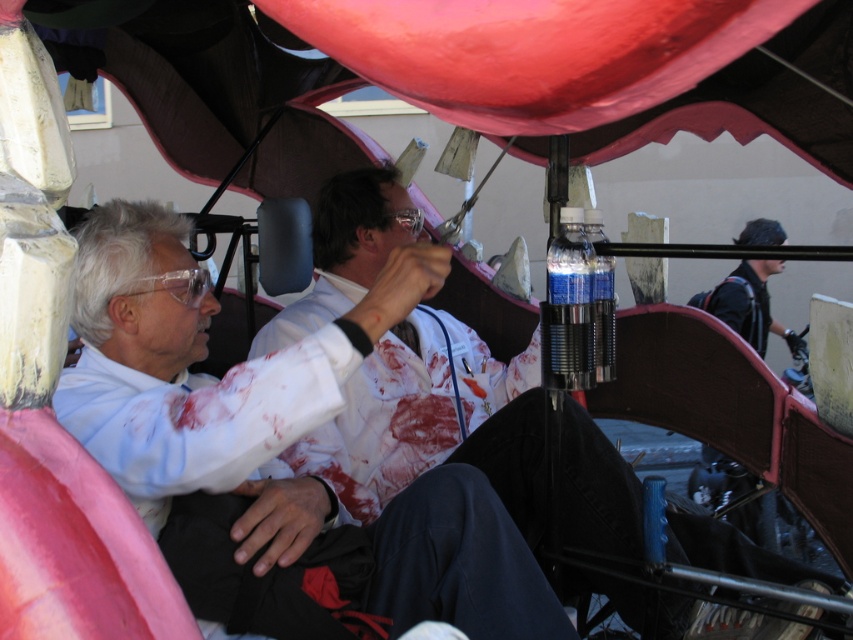
Between point (474, 401) and point (772, 529), which one is positioned in front?

Point (474, 401)

In the scene shown: Can you confirm if blood-stained lab coat at center is wider than dark blue fabric jacket at right?

Correct, the width of blood-stained lab coat at center exceeds that of dark blue fabric jacket at right.

Locate an element on the screen. The image size is (853, 640). blood-stained lab coat at center is located at coordinates (432, 420).

You are a GUI agent. You are given a task and a screenshot of the screen. Output one action in this format:
    pyautogui.click(x=<x>, y=<y>)
    Task: Click on the blood-stained lab coat at center
    Image resolution: width=853 pixels, height=640 pixels.
    Given the screenshot: What is the action you would take?
    432,420

Is point (196, 410) farther from viewer compared to point (485, 458)?

No, it is not.

Does white matte lab coat at center appear under blood-stained lab coat at center?

Yes, white matte lab coat at center is below blood-stained lab coat at center.

The image size is (853, 640). Describe the element at coordinates (202, 394) in the screenshot. I see `white matte lab coat at center` at that location.

You are a GUI agent. You are given a task and a screenshot of the screen. Output one action in this format:
    pyautogui.click(x=<x>, y=<y>)
    Task: Click on the white matte lab coat at center
    
    Given the screenshot: What is the action you would take?
    pyautogui.click(x=202, y=394)

Can you confirm if white matte lab coat at center is positioned below dark blue fabric jacket at right?

Actually, white matte lab coat at center is above dark blue fabric jacket at right.

The width and height of the screenshot is (853, 640). What do you see at coordinates (202, 394) in the screenshot? I see `white matte lab coat at center` at bounding box center [202, 394].

At what (x,y) coordinates should I click in order to perform the action: click on white matte lab coat at center. Please return your answer as a coordinate pair (x, y). The width and height of the screenshot is (853, 640). Looking at the image, I should click on 202,394.